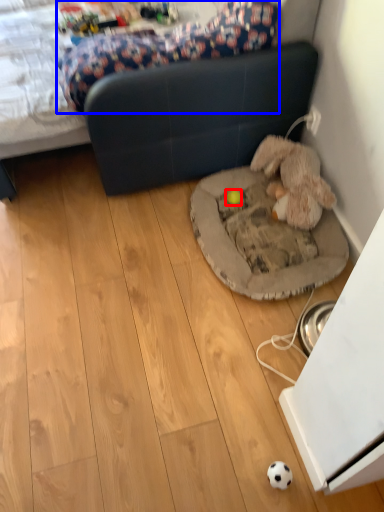
Question: Among these objects, which one is farthest to the camera, toy (highlighted by a red box) or mattress (highlighted by a blue box)?

Choices:
 (A) toy
 (B) mattress

Answer: (A)